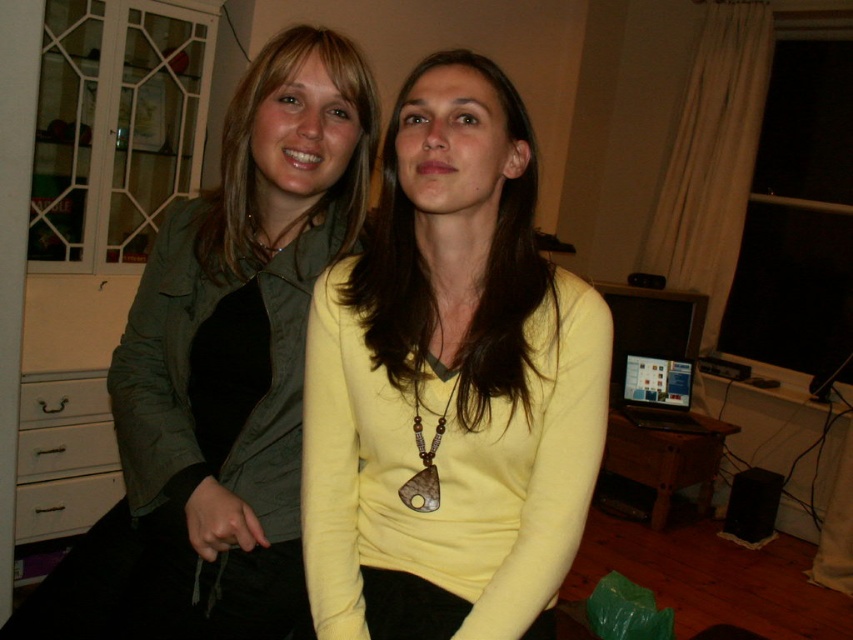
Question: Does yellow matte sweater at center have a greater width compared to matte yellow sweater at center?

Choices:
 (A) no
 (B) yes

Answer: (B)

Question: Which point is farther from the camera taking this photo?

Choices:
 (A) (514, 234)
 (B) (439, 481)

Answer: (A)

Question: Is yellow matte sweater at center in front of matte yellow sweater at center?

Choices:
 (A) no
 (B) yes

Answer: (B)

Question: Does yellow matte sweater at center appear over matte yellow sweater at center?

Choices:
 (A) yes
 (B) no

Answer: (B)

Question: Which object appears closest to the camera in this image?

Choices:
 (A) yellow matte sweater at center
 (B) matte yellow sweater at center

Answer: (A)